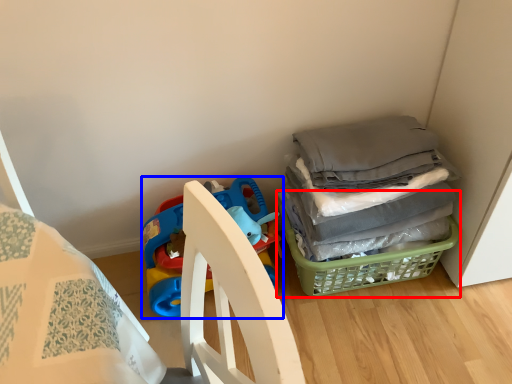
Question: Among these objects, which one is farthest to the camera, basket (highlighted by a red box) or toy (highlighted by a blue box)?

Choices:
 (A) basket
 (B) toy

Answer: (A)